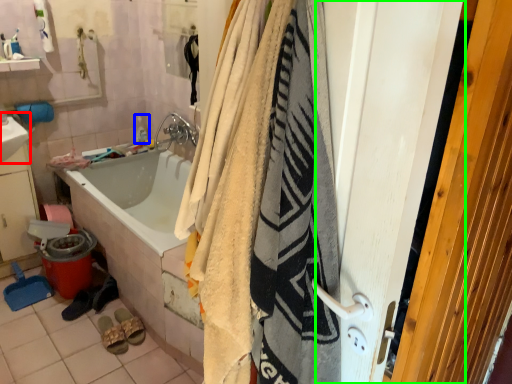
Question: Which object is positioned farthest from sink (highlighted by a red box)? Select from toiletry (highlighted by a blue box) and screen door (highlighted by a green box).

Choices:
 (A) toiletry
 (B) screen door

Answer: (B)